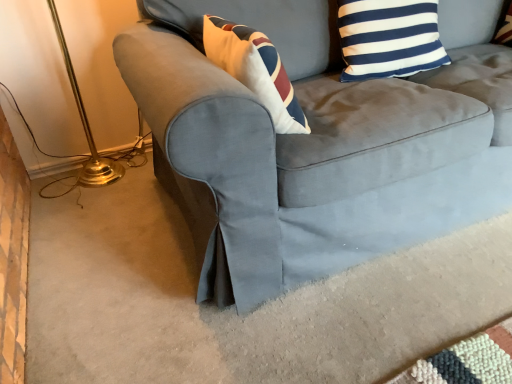
Question: Can you confirm if suede gray couch at lower right is bigger than blue and white striped pillow at upper right?

Choices:
 (A) no
 (B) yes

Answer: (B)

Question: Is suede gray couch at lower right taller than blue and white striped pillow at upper right?

Choices:
 (A) yes
 (B) no

Answer: (A)

Question: From a real-world perspective, is suede gray couch at lower right positioned under blue and white striped pillow at upper right based on gravity?

Choices:
 (A) no
 (B) yes

Answer: (B)

Question: Is suede gray couch at lower right shorter than blue and white striped pillow at upper right?

Choices:
 (A) yes
 (B) no

Answer: (B)

Question: Is suede gray couch at lower right not near blue and white striped pillow at upper right?

Choices:
 (A) no
 (B) yes

Answer: (A)

Question: Is blue and white striped pillow at upper right inside suede gray couch at lower right?

Choices:
 (A) no
 (B) yes

Answer: (B)

Question: Is blue and white striped pillow at upper right with suede gray couch at lower right?

Choices:
 (A) yes
 (B) no

Answer: (B)

Question: From the image's perspective, is blue and white striped pillow at upper right beneath suede gray couch at lower right?

Choices:
 (A) yes
 (B) no

Answer: (B)

Question: From a real-world perspective, is blue and white striped pillow at upper right located beneath suede gray couch at lower right?

Choices:
 (A) yes
 (B) no

Answer: (B)

Question: From the image's perspective, would you say blue and white striped pillow at upper right is positioned over suede gray couch at lower right?

Choices:
 (A) no
 (B) yes

Answer: (B)

Question: Considering the relative sizes of blue and white striped pillow at upper right and suede gray couch at lower right in the image provided, is blue and white striped pillow at upper right smaller than suede gray couch at lower right?

Choices:
 (A) yes
 (B) no

Answer: (A)

Question: Is blue and white striped pillow at upper right far away from suede gray couch at lower right?

Choices:
 (A) no
 (B) yes

Answer: (A)

Question: Is blue and white striped pillow at upper right wider or thinner than suede gray couch at lower right?

Choices:
 (A) thin
 (B) wide

Answer: (A)